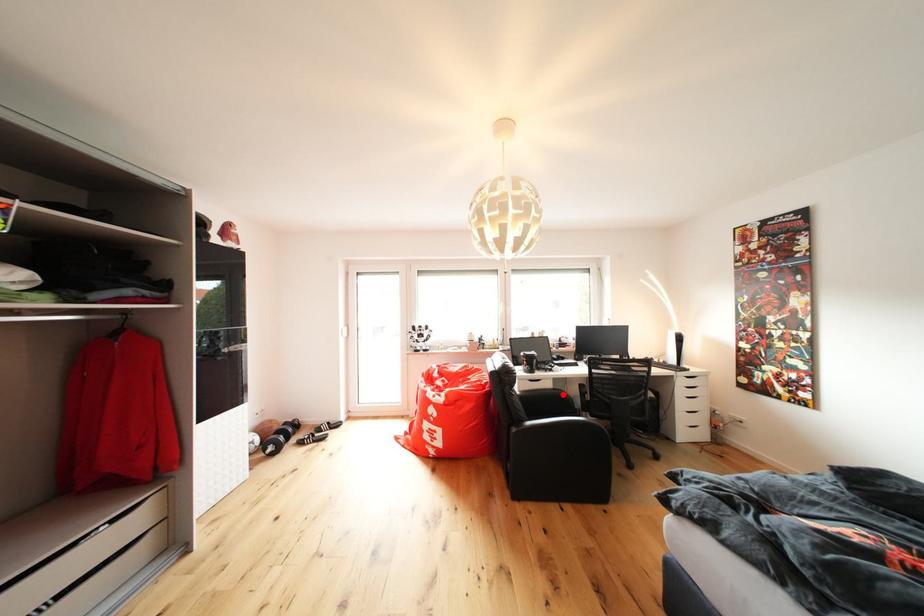
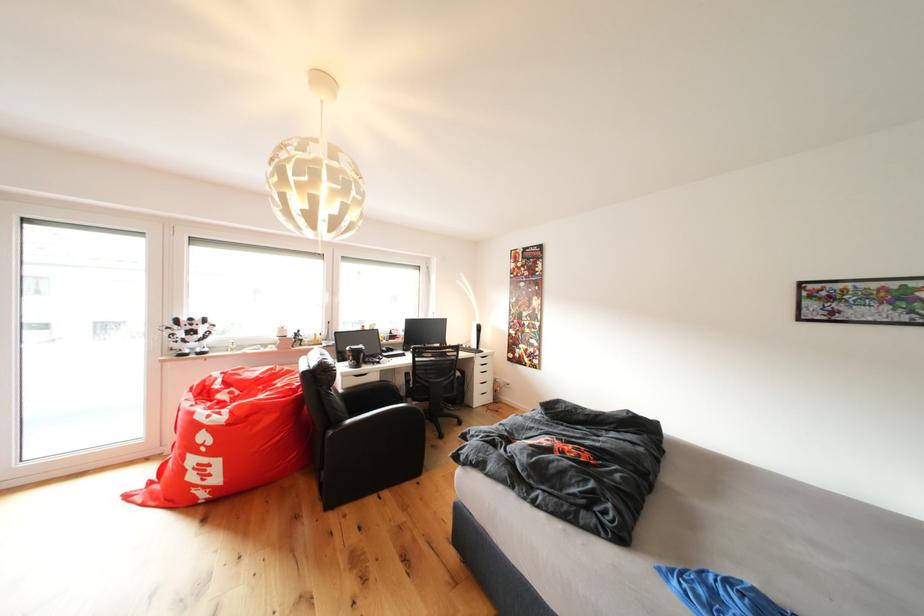
Where in the second image is the point corresponding to the highlighted location from the first image?

(390, 387)